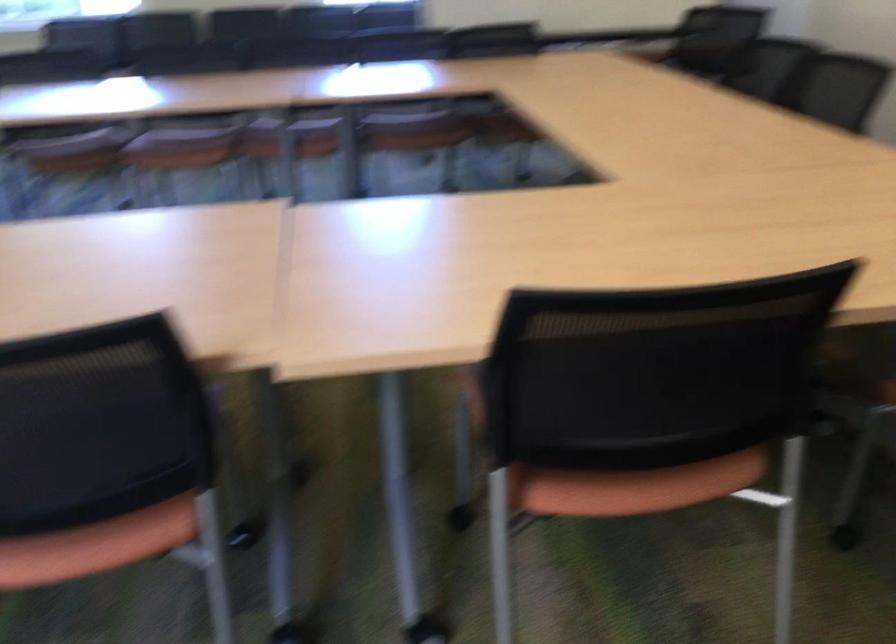
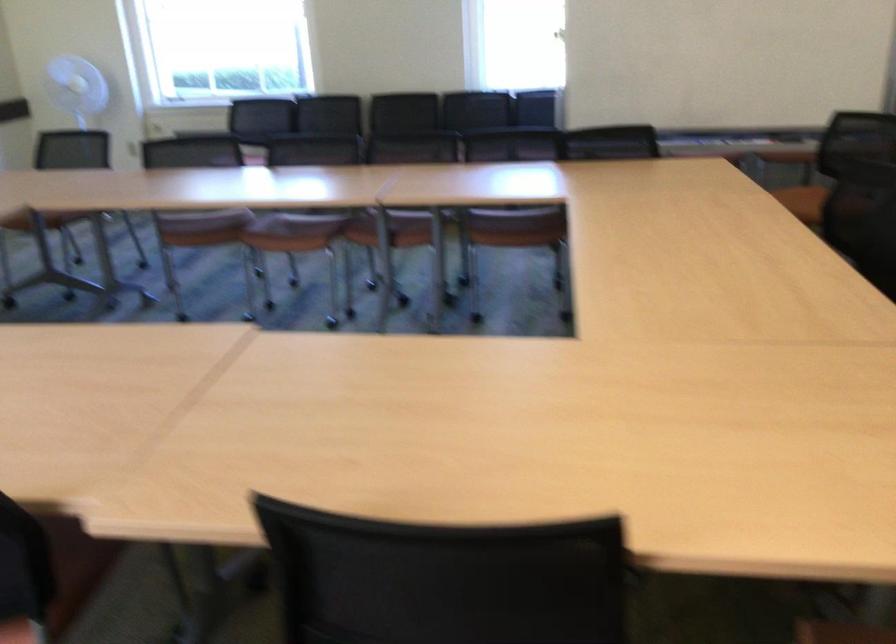
Locate, in the second image, the point that corresponds to point (167, 147) in the first image.

(293, 232)